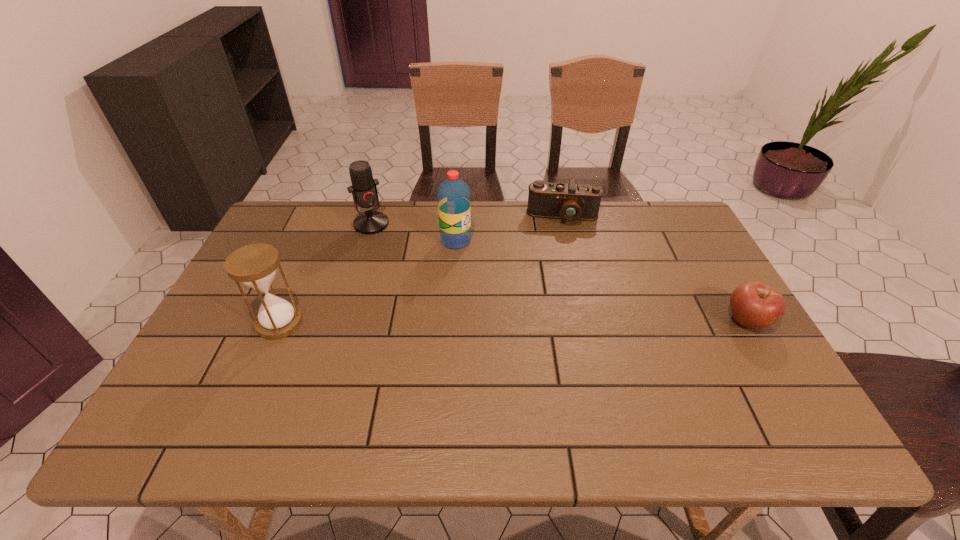
Where is `object present at the left edge`? This screenshot has width=960, height=540. object present at the left edge is located at coordinates (254, 265).

Where is `object that is at the right edge`? The image size is (960, 540). object that is at the right edge is located at coordinates (754, 304).

At what (x,y) coordinates should I click in order to perform the action: click on free region at the far edge. Please return your answer as a coordinate pair (x, y). The image size is (960, 540). Looking at the image, I should click on (632, 244).

At what (x,y) coordinates should I click in order to perform the action: click on vacant area at the near edge. Please return your answer as a coordinate pair (x, y). Looking at the image, I should click on (620, 401).

In the image, there is a desktop. Find the location of `vacant space at the right edge`. vacant space at the right edge is located at coordinates (700, 322).

Find the location of a particular element. The image size is (960, 540). vacant space at the far right corner of the desktop is located at coordinates (675, 219).

This screenshot has height=540, width=960. In the image, there is a desktop. In order to click on vacant space at the near right corner in this screenshot , I will do `click(741, 400)`.

Find the location of a particular element. The height and width of the screenshot is (540, 960). vacant area between the hourglass and the water bottle is located at coordinates (368, 282).

Where is `free space between the second object from left to right and the third object from right to left`? free space between the second object from left to right and the third object from right to left is located at coordinates (414, 232).

Where is `vacant space that's between the leftmost object and the camera`? The height and width of the screenshot is (540, 960). vacant space that's between the leftmost object and the camera is located at coordinates click(x=421, y=270).